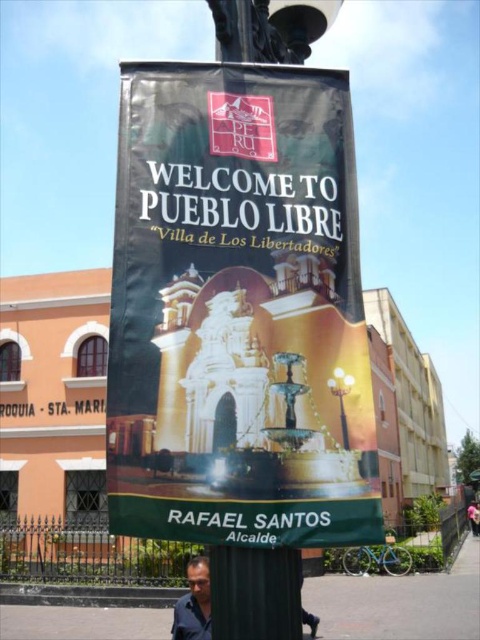
Question: Does matte black shirt at lower center appear over metallic silver streetlight at upper center?

Choices:
 (A) no
 (B) yes

Answer: (A)

Question: Among these objects, which one is farthest from the camera?

Choices:
 (A) matte black shirt at lower center
 (B) black fabric banner at center

Answer: (A)

Question: Can you confirm if matte black shirt at lower center is positioned below metallic silver streetlight at upper center?

Choices:
 (A) yes
 (B) no

Answer: (A)

Question: Which of the following is the closest to the observer?

Choices:
 (A) matte black shirt at lower center
 (B) black fabric banner at center

Answer: (B)

Question: Which of the following is the farthest from the observer?

Choices:
 (A) (211, 380)
 (B) (192, 557)

Answer: (B)

Question: Does black fabric banner at center appear over metallic silver streetlight at upper center?

Choices:
 (A) yes
 (B) no

Answer: (A)